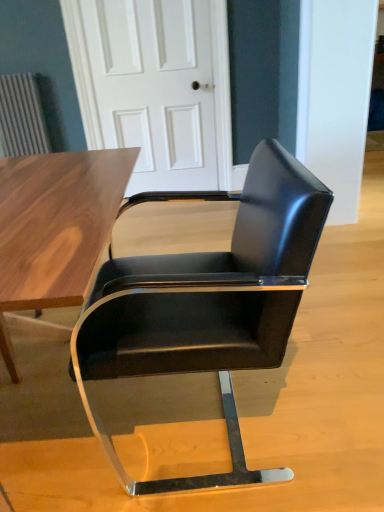
Question: Does white glossy door at center have a lesser width compared to black leather chair at center?

Choices:
 (A) yes
 (B) no

Answer: (A)

Question: Is white glossy door at center oriented towards black leather chair at center?

Choices:
 (A) no
 (B) yes

Answer: (B)

Question: Is white glossy door at center oriented away from black leather chair at center?

Choices:
 (A) no
 (B) yes

Answer: (A)

Question: Does white glossy door at center appear on the right side of black leather chair at center?

Choices:
 (A) yes
 (B) no

Answer: (B)

Question: Is the depth of white glossy door at center greater than that of black leather chair at center?

Choices:
 (A) no
 (B) yes

Answer: (B)

Question: Does white glossy door at center have a smaller size compared to black leather chair at center?

Choices:
 (A) yes
 (B) no

Answer: (A)

Question: Considering the relative sizes of black leather chair at center and white glossy door at center in the image provided, is black leather chair at center smaller than white glossy door at center?

Choices:
 (A) no
 (B) yes

Answer: (A)

Question: Could white glossy door at center be considered to be inside black leather chair at center?

Choices:
 (A) yes
 (B) no

Answer: (B)

Question: Does black leather chair at center have a greater height compared to white glossy door at center?

Choices:
 (A) yes
 (B) no

Answer: (B)

Question: Does black leather chair at center have a greater width compared to white glossy door at center?

Choices:
 (A) no
 (B) yes

Answer: (B)

Question: From a real-world perspective, is black leather chair at center positioned under white glossy door at center based on gravity?

Choices:
 (A) no
 (B) yes

Answer: (B)

Question: Is black leather chair at center shorter than white glossy door at center?

Choices:
 (A) yes
 (B) no

Answer: (A)

Question: Is white glossy door at center wider or thinner than black leather chair at center?

Choices:
 (A) wide
 (B) thin

Answer: (B)